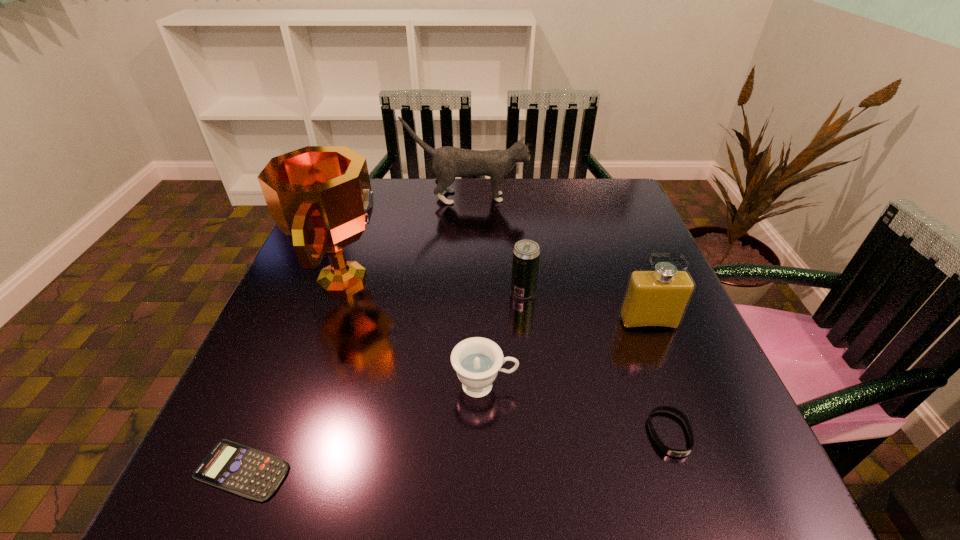
Locate an element on the screen. The image size is (960, 540). free space located 0.130m at the face of the cat is located at coordinates (574, 198).

This screenshot has width=960, height=540. In order to click on free space located 0.310m on the front-facing side of the third tallest object in this screenshot , I will do [x=714, y=490].

At what (x,y) coordinates should I click in order to perform the action: click on free space located 0.100m on the left of the beer can. Please return your answer as a coordinate pair (x, y). This screenshot has width=960, height=540. Looking at the image, I should click on (465, 292).

This screenshot has width=960, height=540. Find the location of `free location located on the side of the third shortest object with the handle`. free location located on the side of the third shortest object with the handle is located at coordinates (670, 385).

Locate an element on the screen. free space located 0.370m on the right of the calculator is located at coordinates (536, 470).

Find the location of `object that is at the far edge`. object that is at the far edge is located at coordinates (448, 162).

At what (x,y) coordinates should I click in order to perform the action: click on wristband positioned at the near edge. Please return your answer as a coordinate pair (x, y). The height and width of the screenshot is (540, 960). Looking at the image, I should click on (665, 449).

Locate an element on the screen. This screenshot has width=960, height=540. calculator positioned at the near edge is located at coordinates (247, 472).

Image resolution: width=960 pixels, height=540 pixels. Identify the location of award present at the left edge. (320, 196).

At what (x,y) coordinates should I click in order to perform the action: click on calculator that is positioned at the left edge. Please return your answer as a coordinate pair (x, y). Image resolution: width=960 pixels, height=540 pixels. Looking at the image, I should click on (247, 472).